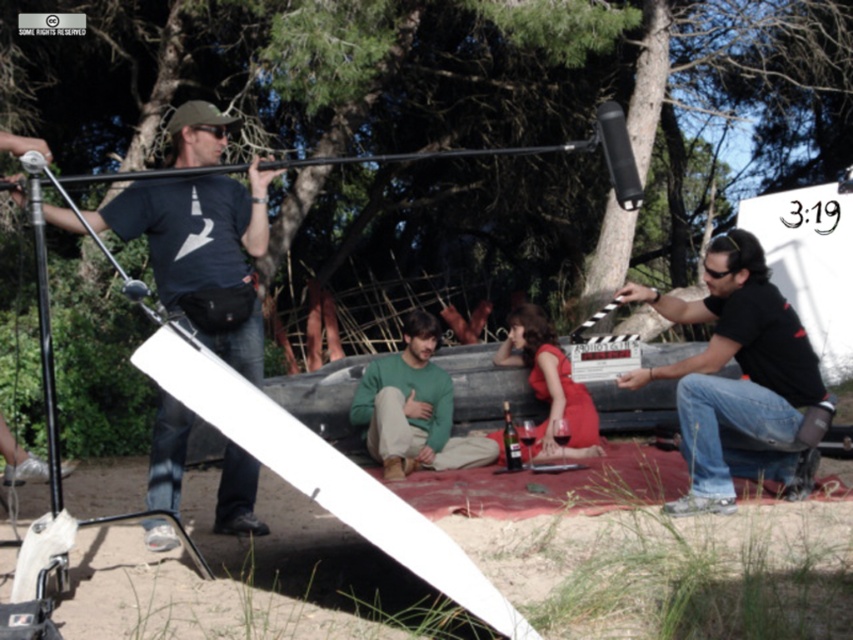
You are a costume designer working on a film set. You need to ensure that the green matte sweater at center and the matte red dress at center are spaced appropriately for a wide shot. The camera requires at least 28 inches between the two garments to capture both clearly. Can the current spacing between them accommodate this requirement?

The distance between the green matte sweater at center and the matte red dress at center is 30.45 inches, which exceeds the required 28 inches. Therefore, the current spacing can accommodate the camera requirement.

You are a costume designer observing the couple in the image. The green matte sweater at center and the matte red dress at center are both part of their outfits. Which clothing item is wider?

The green matte sweater at center is wider than the matte red dress at center because its width surpasses that of the dress.

You are a costume designer observing the couple in the scene. You need to decide which clothing item is shorter in height between the green matte sweater at center and the matte red dress at center. Which one would you choose?

The green matte sweater at center has a lesser height compared to the matte red dress at center, so the green matte sweater at center is shorter in height.